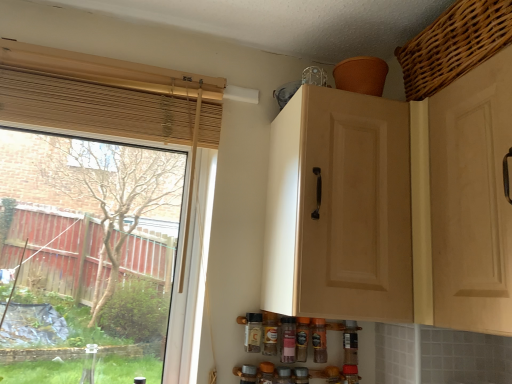
Question: Can you confirm if matte glass spice bottle at lower center, the 5th bottle in the right-to-left sequence, is wider than brown glass spice bottle at lower center, which is the first bottle from right to left?

Choices:
 (A) no
 (B) yes

Answer: (B)

Question: Is the surface of matte glass spice bottle at lower center, the 5th bottle in the right-to-left sequence, in direct contact with brown glass spice bottle at lower center, the 5th bottle from the left?

Choices:
 (A) yes
 (B) no

Answer: (B)

Question: Is brown glass spice bottle at lower center, the 5th bottle from the left, completely or partially inside matte glass spice bottle at lower center, the 5th bottle in the right-to-left sequence?

Choices:
 (A) yes
 (B) no

Answer: (B)

Question: Considering the relative sizes of matte glass spice bottle at lower center, placed as the first bottle when sorted from left to right, and brown glass spice bottle at lower center, the 5th bottle from the left, in the image provided, is matte glass spice bottle at lower center, placed as the first bottle when sorted from left to right, thinner than brown glass spice bottle at lower center, the 5th bottle from the left,?

Choices:
 (A) no
 (B) yes

Answer: (A)

Question: From the image's perspective, is matte glass spice bottle at lower center, the 5th bottle in the right-to-left sequence, over brown glass spice bottle at lower center, which is the first bottle from right to left?

Choices:
 (A) yes
 (B) no

Answer: (A)

Question: Does matte glass spice bottle at lower center, the 5th bottle in the right-to-left sequence, turn towards brown glass spice bottle at lower center, the 5th bottle from the left?

Choices:
 (A) yes
 (B) no

Answer: (B)

Question: Considering the relative sizes of matte wood cabinet at upper center and matte glass spice bottle at lower center, placed as the first bottle when sorted from left to right, in the image provided, is matte wood cabinet at upper center thinner than matte glass spice bottle at lower center, placed as the first bottle when sorted from left to right,?

Choices:
 (A) no
 (B) yes

Answer: (A)

Question: Would you say matte wood cabinet at upper center is a long distance from matte glass spice bottle at lower center, the 5th bottle in the right-to-left sequence?

Choices:
 (A) yes
 (B) no

Answer: (B)

Question: From the image's perspective, is matte wood cabinet at upper center on matte glass spice bottle at lower center, the 5th bottle in the right-to-left sequence?

Choices:
 (A) yes
 (B) no

Answer: (A)

Question: Is matte glass spice bottle at lower center, the 5th bottle in the right-to-left sequence, at the back of matte wood cabinet at upper center?

Choices:
 (A) no
 (B) yes

Answer: (A)

Question: Does matte wood cabinet at upper center have a smaller size compared to matte glass spice bottle at lower center, the 5th bottle in the right-to-left sequence?

Choices:
 (A) yes
 (B) no

Answer: (B)

Question: Considering the relative sizes of matte wood cabinet at upper center and matte glass spice bottle at lower center, the 5th bottle in the right-to-left sequence, in the image provided, is matte wood cabinet at upper center bigger than matte glass spice bottle at lower center, the 5th bottle in the right-to-left sequence,?

Choices:
 (A) no
 (B) yes

Answer: (B)

Question: Can you confirm if woven brown basket at upper right is wider than transparent glass window at left?

Choices:
 (A) yes
 (B) no

Answer: (A)